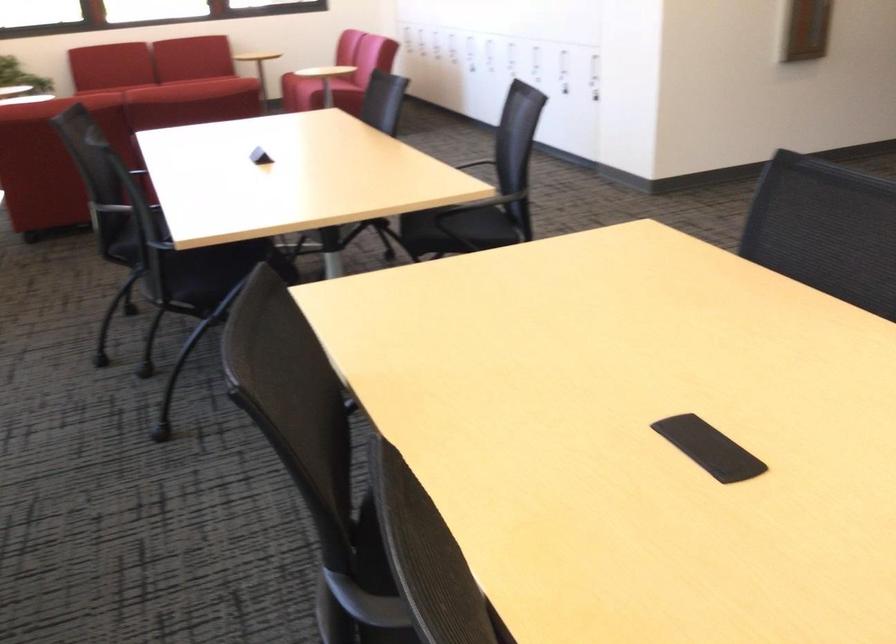
You are a GUI agent. You are given a task and a screenshot of the screen. Output one action in this format:
    pyautogui.click(x=<x>, y=<y>)
    Task: Click on the black chair armrest
    This screenshot has width=896, height=644.
    Given the screenshot: What is the action you would take?
    pyautogui.click(x=475, y=164)